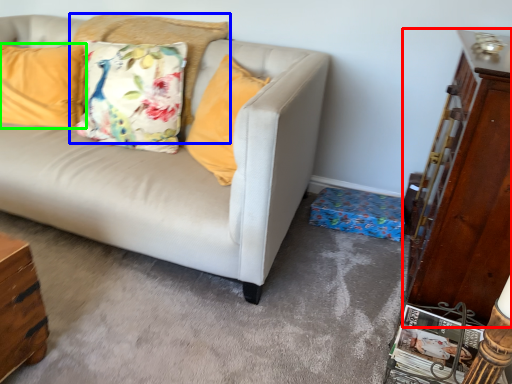
Question: Based on their relative distances, which object is nearer to dresser (highlighted by a red box)? Choose from pillow (highlighted by a blue box) and pillow (highlighted by a green box).

Choices:
 (A) pillow
 (B) pillow

Answer: (A)